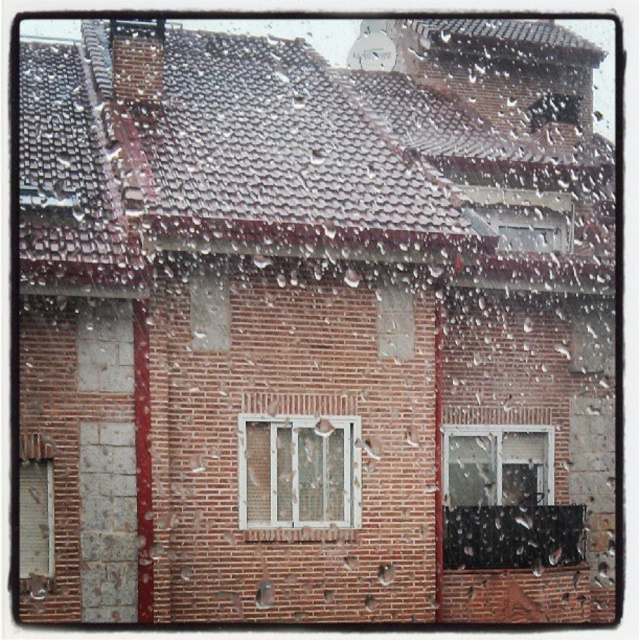
You are standing in a room and looking through the windows. There are two windows mentioned here, the white plastic window at center and the clear glass window at center. Which one do you see first when looking through them?

The white plastic window at center is closer to the viewer than the clear glass window at center, so you see the white plastic window at center first.

You are looking through a rainy window at a brick building. There are two points marked on the window. The first point is at coordinates point (292, 460) and the second is at point (481, 500). Which point is closer to you on the window?

Point (292, 460) is in front of point (481, 500), so it is closer to you on the window.

You are looking through a window at a brick building. There are two windows in front of you. One is a white plastic window at center and the other is a clear glass window at center. Which window is closer to you?

The white plastic window at center is positioned over the clear glass window at center, so the white plastic window at center is closer to you.